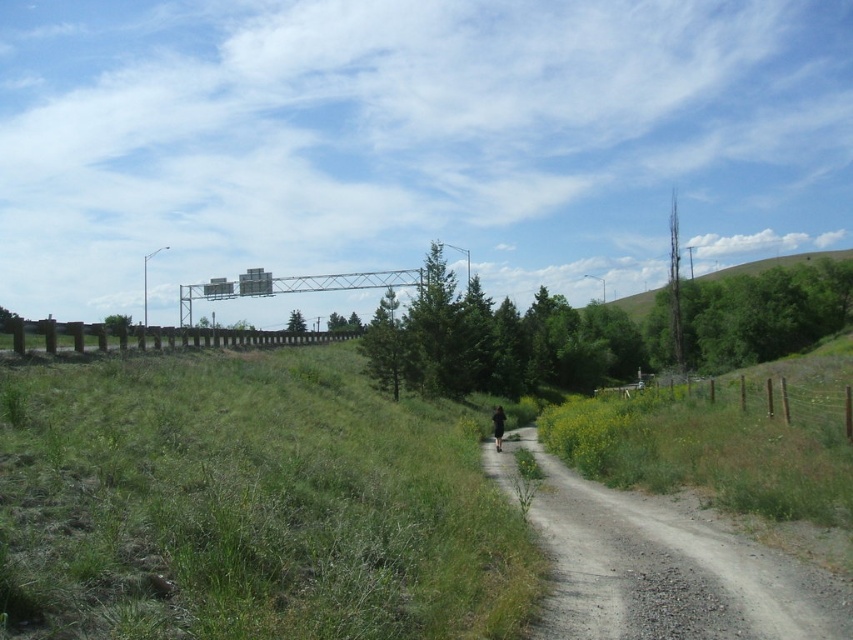
Question: From the image, what is the correct spatial relationship of green grassy at lower left in relation to green wooden fence at right?

Choices:
 (A) left
 (B) right

Answer: (A)

Question: Which of the following is the closest to the observer?

Choices:
 (A) (498, 417)
 (B) (816, 257)

Answer: (A)

Question: Estimate the real-world distances between objects in this image. Which object is closer to the gray gravel path at center?

Choices:
 (A) green grassy at lower left
 (B) black fabric person at center-right
 (C) green wooden fence at right

Answer: (A)

Question: Is green wooden fence at right positioned in front of brown wooden fence at left?

Choices:
 (A) no
 (B) yes

Answer: (B)

Question: Which of the following is the closest to the observer?

Choices:
 (A) (735, 403)
 (B) (497, 442)
 (C) (480, 557)

Answer: (C)

Question: Is gray gravel path at center to the right of green grassy hillside at upper right from the viewer's perspective?

Choices:
 (A) yes
 (B) no

Answer: (B)